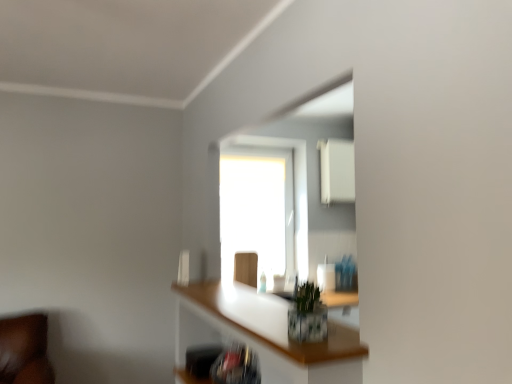
At what (x,y) coordinates should I click in order to perform the action: click on free point in front of green leafy plant at center. Please return your answer as a coordinate pair (x, y). The width and height of the screenshot is (512, 384). Looking at the image, I should click on (312, 345).